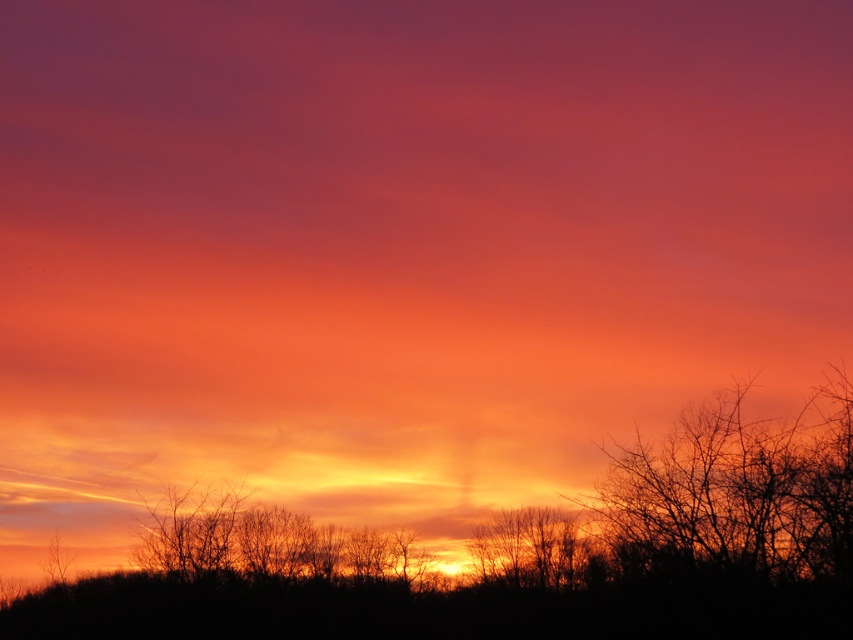
Question: Does silhouette bare branches at right appear on the left side of silhouette bare tree at center?

Choices:
 (A) yes
 (B) no

Answer: (B)

Question: Does silhouette bare branches at right have a larger size compared to silhouette bare tree at center?

Choices:
 (A) yes
 (B) no

Answer: (B)

Question: Is silhouette bare branches at right below silhouette bare tree at center?

Choices:
 (A) yes
 (B) no

Answer: (B)

Question: Which object appears farthest from the camera in this image?

Choices:
 (A) silhouette bare branches at right
 (B) silhouette bare tree at center

Answer: (B)